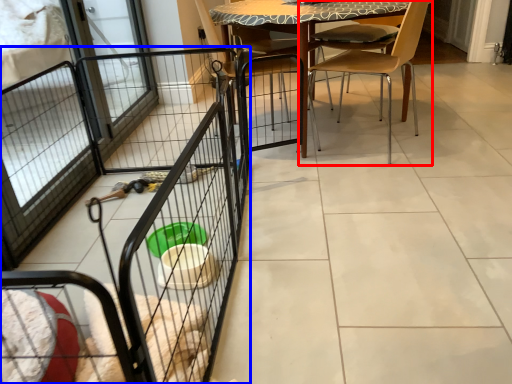
Question: Which object appears closest to the camera in this image, chair (highlighted by a red box) or cage (highlighted by a blue box)?

Choices:
 (A) chair
 (B) cage

Answer: (B)